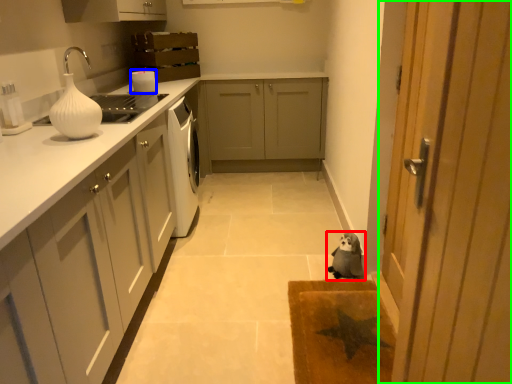
Question: Which is farther away from dog (highlighted by a red box)? appliance (highlighted by a blue box) or door (highlighted by a green box)?

Choices:
 (A) appliance
 (B) door

Answer: (A)